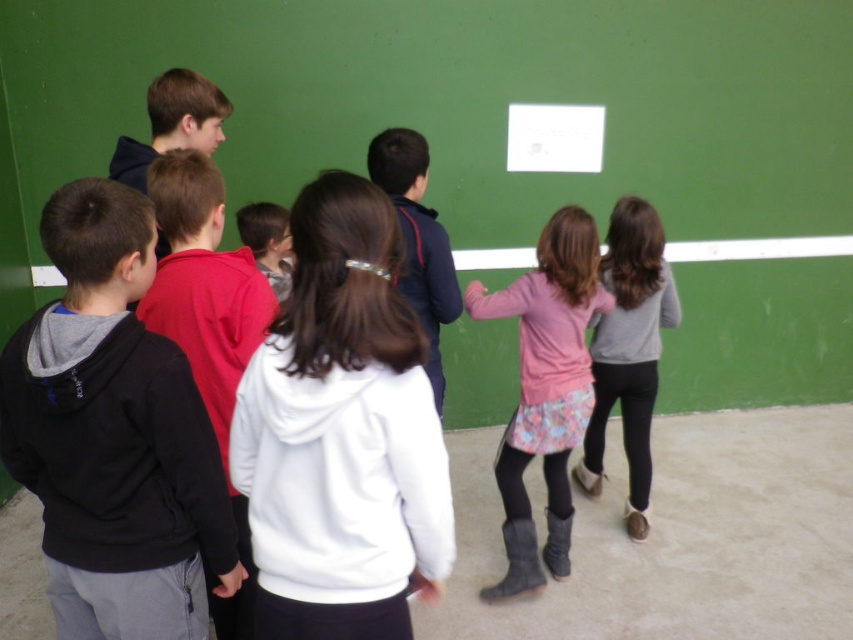
Question: Is white fleece jacket at center in front of floral skirt at center?

Choices:
 (A) no
 (B) yes

Answer: (B)

Question: Which point is farther to the camera?

Choices:
 (A) tap(415, 145)
 (B) tap(635, 220)
 (C) tap(351, 513)

Answer: (B)

Question: Is black hoodie at left closer to the viewer compared to dark blue hoodie at center?

Choices:
 (A) no
 (B) yes

Answer: (B)

Question: Which of the following is the farthest from the observer?

Choices:
 (A) (207, 440)
 (B) (659, 253)
 (C) (366, 198)
 (D) (437, 294)

Answer: (B)

Question: Is pink fabric skirt at center thinner than floral skirt at center?

Choices:
 (A) yes
 (B) no

Answer: (B)

Question: Which object is farther from the camera taking this photo?

Choices:
 (A) white fleece jacket at center
 (B) dark blue hoodie at center

Answer: (B)